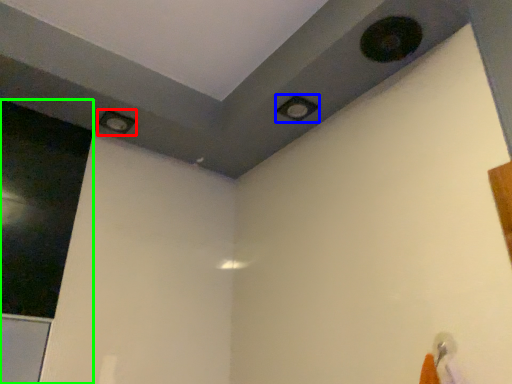
Question: Considering the real-world distances, which object is closest to hole (highlighted by a red box)? hole (highlighted by a blue box) or screen door (highlighted by a green box).

Choices:
 (A) hole
 (B) screen door

Answer: (B)